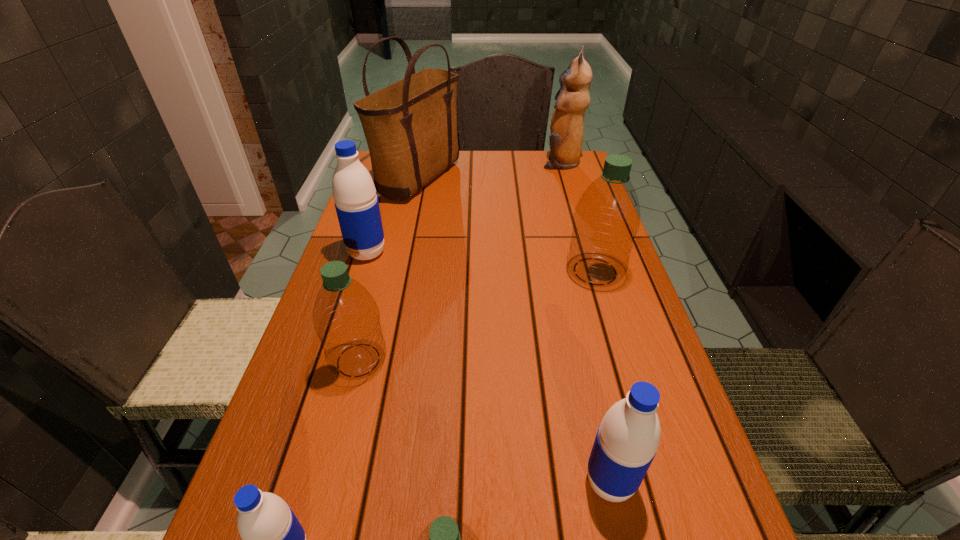
Find the location of a particular element. This screenshot has width=960, height=540. free space located on the face of the cat is located at coordinates coord(508,163).

I want to click on vacant space located on the face of the cat, so click(482, 163).

At what (x,y) coordinates should I click in order to perform the action: click on vacant region located 0.280m on the face of the cat. Please return your answer as a coordinate pair (x, y). The width and height of the screenshot is (960, 540). Looking at the image, I should click on tap(463, 163).

The height and width of the screenshot is (540, 960). I want to click on free point located 0.390m on the front of the farthest blue water bottle, so 322,397.

Where is `blank space located 0.340m on the front of the farthest green water bottle`? This screenshot has height=540, width=960. blank space located 0.340m on the front of the farthest green water bottle is located at coordinates (640, 421).

Where is `vacant space situated 0.260m on the back of the second biggest green water bottle`? The width and height of the screenshot is (960, 540). vacant space situated 0.260m on the back of the second biggest green water bottle is located at coordinates (384, 261).

Find the location of a particular element. vacant region located on the left of the rightmost blue water bottle is located at coordinates (385, 482).

This screenshot has height=540, width=960. In order to click on tote bag at the far edge in this screenshot , I will do `click(410, 126)`.

I want to click on cat that is at the far edge, so click(567, 123).

In order to click on tote bag that is at the left edge in this screenshot , I will do `click(410, 126)`.